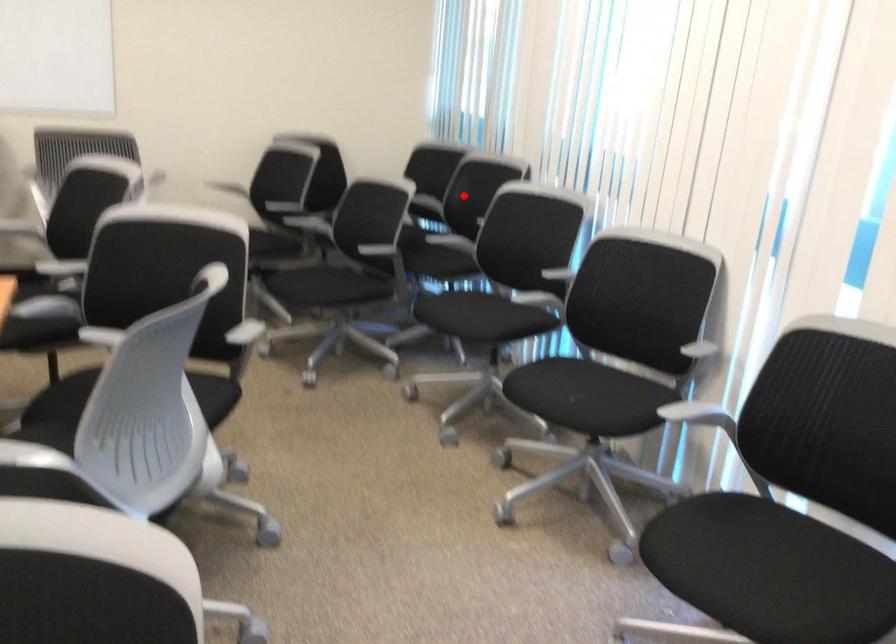
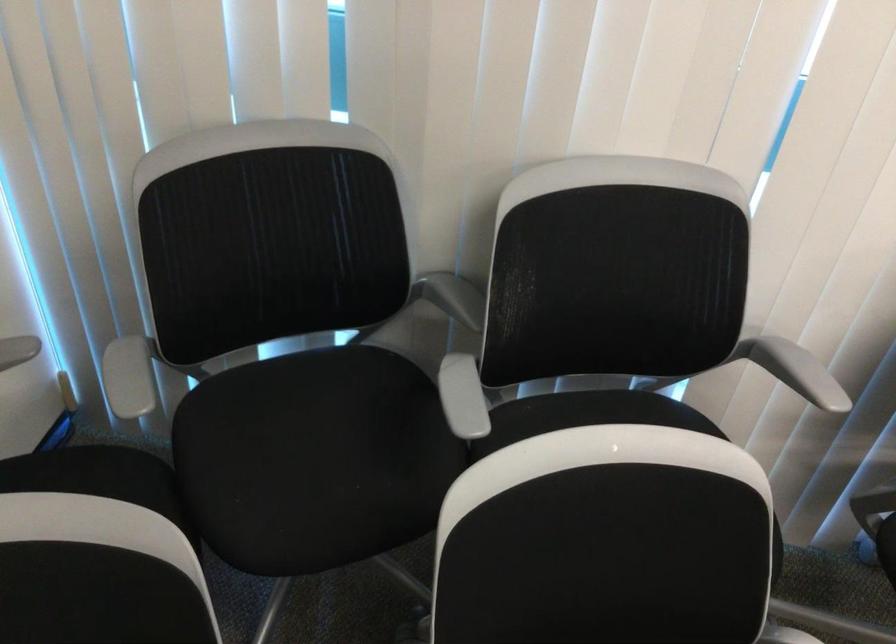
The point at the highlighted location is marked in the first image. Where is the corresponding point in the second image?

(453, 297)